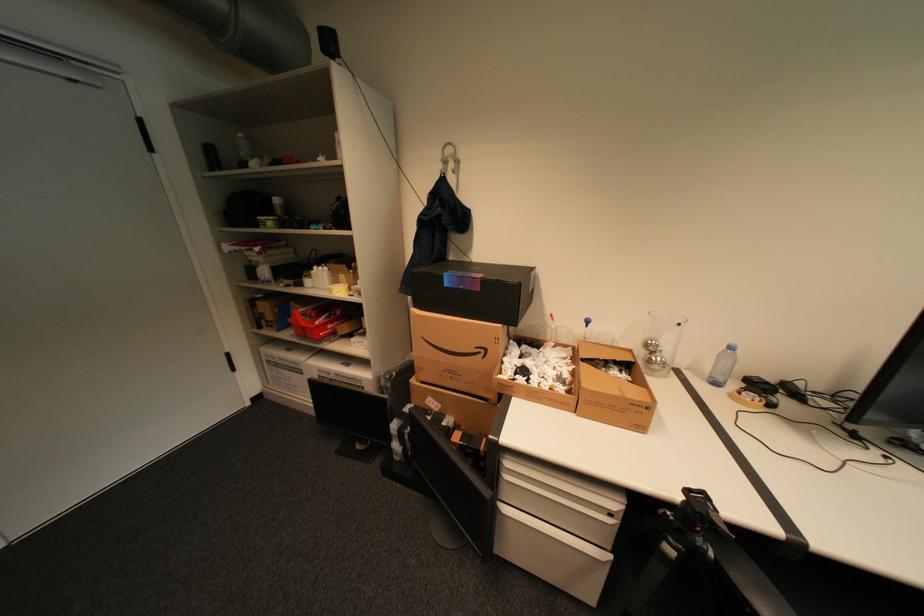
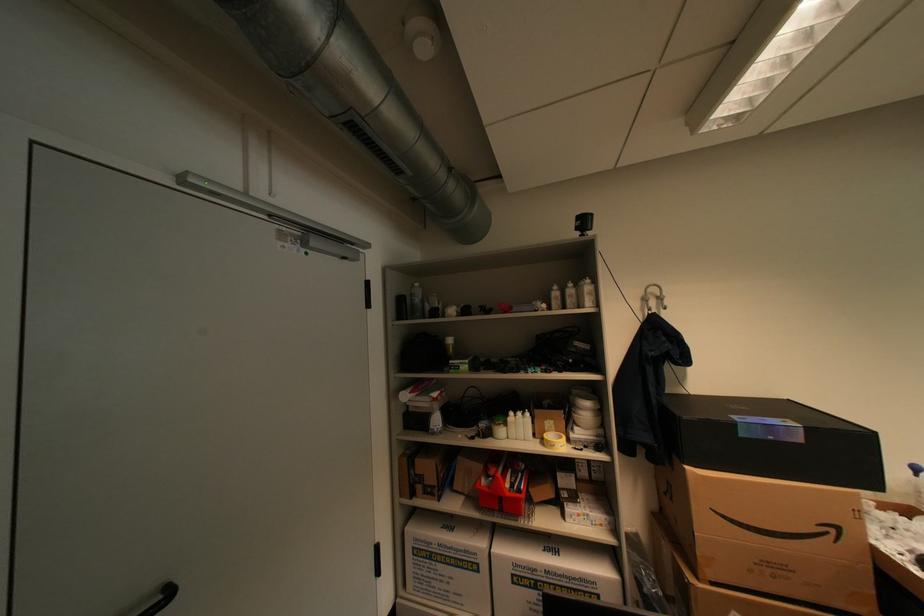
Locate, in the second image, the point that corresponds to [323,268] in the first image.

(519, 414)